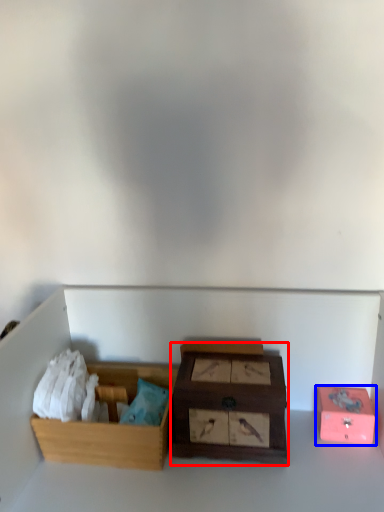
Question: Which object is closer to the camera taking this photo, box (highlighted by a red box) or box (highlighted by a blue box)?

Choices:
 (A) box
 (B) box

Answer: (A)